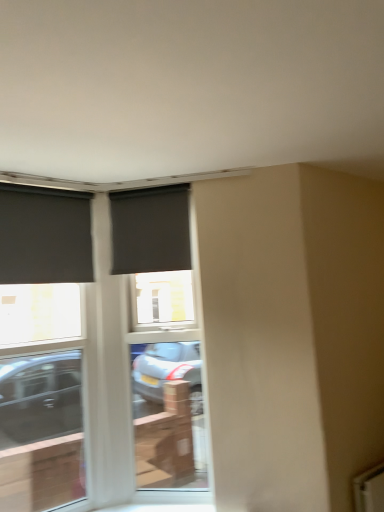
At what (x,y) coordinates should I click in order to perform the action: click on matte black roller blind at left, which is counted as the first window, starting from the left. Please return your answer as a coordinate pair (x, y). This screenshot has height=512, width=384. Looking at the image, I should click on (44, 236).

Describe the element at coordinates (95, 351) in the screenshot. I see `matte black window at left, placed as the 2th window when sorted from right to left` at that location.

You are a GUI agent. You are given a task and a screenshot of the screen. Output one action in this format:
    pyautogui.click(x=<x>, y=<y>)
    Task: Click on the matte black roller blind at left, which ranks as the third window in right-to-left order
    This screenshot has width=384, height=512.
    Given the screenshot: What is the action you would take?
    pyautogui.click(x=44, y=236)

Find the location of a particular element. Image resolution: width=384 pixels, height=512 pixels. window below the matte black screen door at center (from the image's perspective) is located at coordinates (95, 351).

Considering the positions of objects matte black screen door at center and matte black window at left, which appears as the 2th window when viewed from the left, in the image provided, who is behind, matte black screen door at center or matte black window at left, which appears as the 2th window when viewed from the left,?

matte black screen door at center is further from the camera.

From the image's perspective, is matte black screen door at center above or below matte black window at left, which appears as the 2th window when viewed from the left?

matte black screen door at center is above matte black window at left, which appears as the 2th window when viewed from the left.

Which is more to the left, matte black screen door at center or matte black window at left, which appears as the 2th window when viewed from the left?

matte black window at left, which appears as the 2th window when viewed from the left, is more to the left.

Considering the relative positions of matte black roller blind at left, which ranks as the third window in right-to-left order, and matte black screen door at center in the image provided, is matte black roller blind at left, which ranks as the third window in right-to-left order, to the left of matte black screen door at center from the viewer's perspective?

Yes, matte black roller blind at left, which ranks as the third window in right-to-left order, is to the left of matte black screen door at center.

From a real-world perspective, is matte black roller blind at left, which ranks as the third window in right-to-left order, on top of matte black screen door at center?

Indeed, from a real-world perspective, matte black roller blind at left, which ranks as the third window in right-to-left order, stands above matte black screen door at center.

What's the angular difference between matte black roller blind at left, which ranks as the third window in right-to-left order, and matte black screen door at center's facing directions?

matte black roller blind at left, which ranks as the third window in right-to-left order, and matte black screen door at center are facing 46.9 degrees away from each other.

Considering the relative sizes of matte black roller blind at left, which ranks as the third window in right-to-left order, and matte black screen door at center in the image provided, is matte black roller blind at left, which ranks as the third window in right-to-left order, bigger than matte black screen door at center?

Incorrect, matte black roller blind at left, which ranks as the third window in right-to-left order, is not larger than matte black screen door at center.

Considering the sizes of objects matte black roller blind at center, arranged as the 3th window when viewed from the left, and matte black window at left, placed as the 2th window when sorted from right to left, in the image provided, who is wider, matte black roller blind at center, arranged as the 3th window when viewed from the left, or matte black window at left, placed as the 2th window when sorted from right to left,?

matte black window at left, placed as the 2th window when sorted from right to left.

Consider the image. Are matte black roller blind at center, arranged as the 3th window when viewed from the left, and matte black window at left, placed as the 2th window when sorted from right to left, beside each other?

No, matte black roller blind at center, arranged as the 3th window when viewed from the left, is not next to matte black window at left, placed as the 2th window when sorted from right to left.

Identify the location of the 2nd window behind the matte black window at left, placed as the 2th window when sorted from right to left. tap(150, 230).

From a real-world perspective, between matte black window at left, which appears as the 2th window when viewed from the left, and matte black roller blind at left, which ranks as the third window in right-to-left order, who is vertically higher?

matte black roller blind at left, which ranks as the third window in right-to-left order, is physically above.

Can you confirm if matte black window at left, which appears as the 2th window when viewed from the left, is shorter than matte black roller blind at left, which is counted as the first window, starting from the left?

No, matte black window at left, which appears as the 2th window when viewed from the left, is not shorter than matte black roller blind at left, which is counted as the first window, starting from the left.

Locate an element on the screen. Image resolution: width=384 pixels, height=512 pixels. window beneath the matte black roller blind at left, which is counted as the first window, starting from the left (from a real-world perspective) is located at coordinates (95, 351).

From the picture: Considering the positions of objects matte black window at left, which appears as the 2th window when viewed from the left, and matte black roller blind at left, which ranks as the third window in right-to-left order, in the image provided, who is more to the right, matte black window at left, which appears as the 2th window when viewed from the left, or matte black roller blind at left, which ranks as the third window in right-to-left order,?

matte black window at left, which appears as the 2th window when viewed from the left.

Which object is thinner, matte black roller blind at left, which is counted as the first window, starting from the left, or matte black roller blind at center, which is the 1th window from right to left?

matte black roller blind at center, which is the 1th window from right to left.

From a real-world perspective, which is physically above, matte black roller blind at left, which ranks as the third window in right-to-left order, or matte black roller blind at center, which is the 1th window from right to left?

From a 3D spatial view, matte black roller blind at center, which is the 1th window from right to left, is above.

Is point (25, 224) closer or farther from the camera than point (130, 238)?

Point (25, 224) is closer to the camera than point (130, 238).

Locate an element on the screen. The image size is (384, 512). window above the matte black roller blind at left, which is counted as the first window, starting from the left (from a real-world perspective) is located at coordinates (150, 230).

From the image's perspective, between matte black roller blind at center, which is the 1th window from right to left, and matte black roller blind at left, which is counted as the first window, starting from the left, which one is located above?

matte black roller blind at center, which is the 1th window from right to left, from the image's perspective.

Locate an element on the screen. the 1st window below the matte black roller blind at center, which is the 1th window from right to left (from the image's perspective) is located at coordinates (44, 236).

Looking at this image, is matte black roller blind at center, arranged as the 3th window when viewed from the left, looking in the opposite direction of matte black roller blind at left, which ranks as the third window in right-to-left order?

matte black roller blind at center, arranged as the 3th window when viewed from the left, is not turned away from matte black roller blind at left, which ranks as the third window in right-to-left order.

Is point (186, 225) closer to viewer compared to point (62, 268)?

No, (186, 225) is behind (62, 268).

Can you tell me how much matte black screen door at center and matte black roller blind at left, which is counted as the first window, starting from the left, differ in facing direction?

46.9 degrees.

Is matte black screen door at center further to the viewer compared to matte black roller blind at left, which ranks as the third window in right-to-left order?

Yes, matte black screen door at center is behind matte black roller blind at left, which ranks as the third window in right-to-left order.

Find the location of `the 1st window above the matte black screen door at center (from the image's perspective)`. the 1st window above the matte black screen door at center (from the image's perspective) is located at coordinates [44, 236].

The height and width of the screenshot is (512, 384). Identify the location of the 1st window above the matte black screen door at center (from a real-world perspective). (95, 351).

From the image's perspective, starting from the matte black screen door at center, which window is the 1st one above? Please provide its 2D coordinates.

[(44, 236)]

Estimate the real-world distances between objects in this image. Which object is closer to matte black roller blind at center, which is the 1th window from right to left, matte black window at left, placed as the 2th window when sorted from right to left, or matte black screen door at center?

The object closer to matte black roller blind at center, which is the 1th window from right to left, is matte black screen door at center.

Based on the photo, which object lies further to the anchor point matte black window at left, which appears as the 2th window when viewed from the left, matte black screen door at center or matte black roller blind at left, which ranks as the third window in right-to-left order?

The object further to matte black window at left, which appears as the 2th window when viewed from the left, is matte black roller blind at left, which ranks as the third window in right-to-left order.

In the scene shown: Which object lies further to the anchor point matte black screen door at center, matte black roller blind at center, which is the 1th window from right to left, or matte black roller blind at left, which is counted as the first window, starting from the left?

matte black roller blind at left, which is counted as the first window, starting from the left, lies further to matte black screen door at center than the other object.

When comparing their distances from matte black roller blind at left, which ranks as the third window in right-to-left order, does matte black window at left, placed as the 2th window when sorted from right to left, or matte black roller blind at center, arranged as the 3th window when viewed from the left, seem closer?

Among the two, matte black roller blind at center, arranged as the 3th window when viewed from the left, is located nearer to matte black roller blind at left, which ranks as the third window in right-to-left order.

From the image, which object appears to be nearer to matte black screen door at center, matte black window at left, placed as the 2th window when sorted from right to left, or matte black roller blind at center, arranged as the 3th window when viewed from the left?

matte black window at left, placed as the 2th window when sorted from right to left, lies closer to matte black screen door at center than the other object.

When comparing their distances from matte black roller blind at left, which is counted as the first window, starting from the left, does matte black roller blind at center, which is the 1th window from right to left, or matte black window at left, which appears as the 2th window when viewed from the left, seem closer?

matte black roller blind at center, which is the 1th window from right to left.

Based on the photo, based on their spatial positions, is matte black roller blind at left, which is counted as the first window, starting from the left, or matte black roller blind at center, arranged as the 3th window when viewed from the left, further from matte black window at left, which appears as the 2th window when viewed from the left?

matte black roller blind at center, arranged as the 3th window when viewed from the left, lies further to matte black window at left, which appears as the 2th window when viewed from the left, than the other object.

When comparing their distances from matte black screen door at center, does matte black roller blind at left, which is counted as the first window, starting from the left, or matte black roller blind at center, which is the 1th window from right to left, seem closer?

matte black roller blind at center, which is the 1th window from right to left, is positioned closer to the anchor matte black screen door at center.

Locate an element on the screen. The width and height of the screenshot is (384, 512). screen door that lies between matte black roller blind at left, which ranks as the third window in right-to-left order, and matte black window at left, placed as the 2th window when sorted from right to left, from top to bottom is located at coordinates (162, 336).

Where is `screen door between matte black roller blind at center, arranged as the 3th window when viewed from the left, and matte black window at left, placed as the 2th window when sorted from right to left, in the up-down direction`? screen door between matte black roller blind at center, arranged as the 3th window when viewed from the left, and matte black window at left, placed as the 2th window when sorted from right to left, in the up-down direction is located at coordinates (162, 336).

I want to click on window between matte black roller blind at center, arranged as the 3th window when viewed from the left, and matte black screen door at center, in the vertical direction, so click(x=44, y=236).

Where is `window between matte black roller blind at center, which is the 1th window from right to left, and matte black window at left, which appears as the 2th window when viewed from the left, in the up-down direction`? Image resolution: width=384 pixels, height=512 pixels. window between matte black roller blind at center, which is the 1th window from right to left, and matte black window at left, which appears as the 2th window when viewed from the left, in the up-down direction is located at coordinates (44, 236).